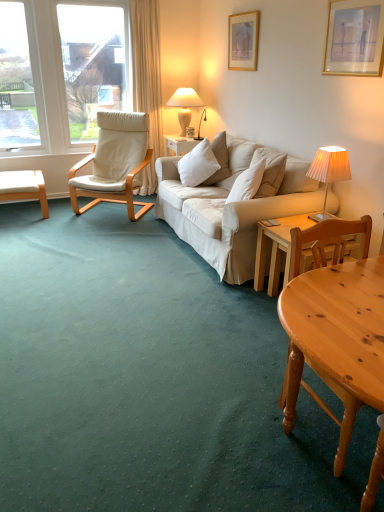
Question: Which direction should I rotate to look at wooden picture frame at upper center, positioned as the second picture frame in right-to-left order?

Choices:
 (A) right
 (B) left

Answer: (A)

Question: Is pleated fabric lampshade at right, positioned as the first lamp in right-to-left order, to the right of white soft cushion at center from the viewer's perspective?

Choices:
 (A) no
 (B) yes

Answer: (B)

Question: Is pleated fabric lampshade at right, which is counted as the first lamp, starting from the bottom, to the left of white soft cushion at center from the viewer's perspective?

Choices:
 (A) yes
 (B) no

Answer: (B)

Question: Considering the relative sizes of pleated fabric lampshade at right, placed as the 2th lamp when sorted from top to bottom, and white soft cushion at center in the image provided, is pleated fabric lampshade at right, placed as the 2th lamp when sorted from top to bottom, bigger than white soft cushion at center?

Choices:
 (A) yes
 (B) no

Answer: (B)

Question: Considering the relative sizes of pleated fabric lampshade at right, positioned as the second lamp in back-to-front order, and white soft cushion at center in the image provided, is pleated fabric lampshade at right, positioned as the second lamp in back-to-front order, wider than white soft cushion at center?

Choices:
 (A) yes
 (B) no

Answer: (B)

Question: Is pleated fabric lampshade at right, which is counted as the first lamp, starting from the bottom, thinner than white soft cushion at center?

Choices:
 (A) no
 (B) yes

Answer: (B)

Question: Are pleated fabric lampshade at right, positioned as the second lamp in back-to-front order, and white soft cushion at center located far from each other?

Choices:
 (A) yes
 (B) no

Answer: (A)

Question: Is wooden picture frame at upper center, the first picture frame viewed from the back, closer to the viewer compared to pleated fabric lampshade at right, which is the 2th lamp from left to right?

Choices:
 (A) no
 (B) yes

Answer: (A)

Question: Can you confirm if wooden picture frame at upper center, the 2th picture frame in the front-to-back sequence, is shorter than pleated fabric lampshade at right, placed as the 2th lamp when sorted from top to bottom?

Choices:
 (A) yes
 (B) no

Answer: (B)

Question: Is wooden picture frame at upper center, marked as the 2th picture frame in a bottom-to-top arrangement, at the right side of pleated fabric lampshade at right, placed as the 1th lamp when sorted from front to back?

Choices:
 (A) no
 (B) yes

Answer: (A)

Question: Is wooden picture frame at upper center, positioned as the first picture frame in left-to-right order, far away from pleated fabric lampshade at right, placed as the 2th lamp when sorted from top to bottom?

Choices:
 (A) yes
 (B) no

Answer: (A)

Question: Is wooden picture frame at upper center, the 2th picture frame in the front-to-back sequence, bigger than pleated fabric lampshade at right, placed as the 1th lamp when sorted from front to back?

Choices:
 (A) no
 (B) yes

Answer: (A)

Question: From the image's perspective, would you say wooden picture frame at upper center, the first picture frame viewed from the back, is positioned over pleated fabric lampshade at right, which is counted as the first lamp, starting from the bottom?

Choices:
 (A) yes
 (B) no

Answer: (A)

Question: Does wooden picture frame at upper center, positioned as the second picture frame in right-to-left order, have a lesser height compared to white leather chair at left?

Choices:
 (A) yes
 (B) no

Answer: (A)